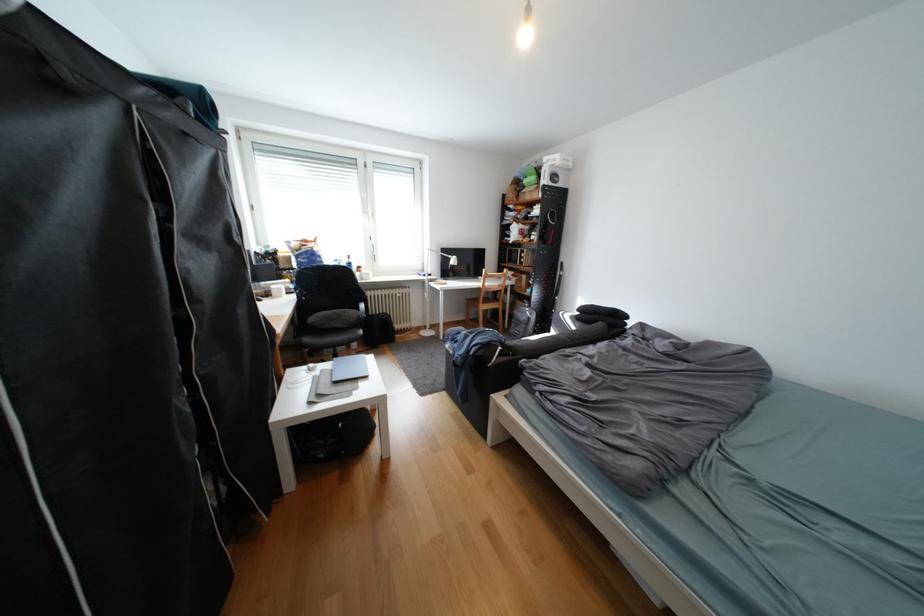
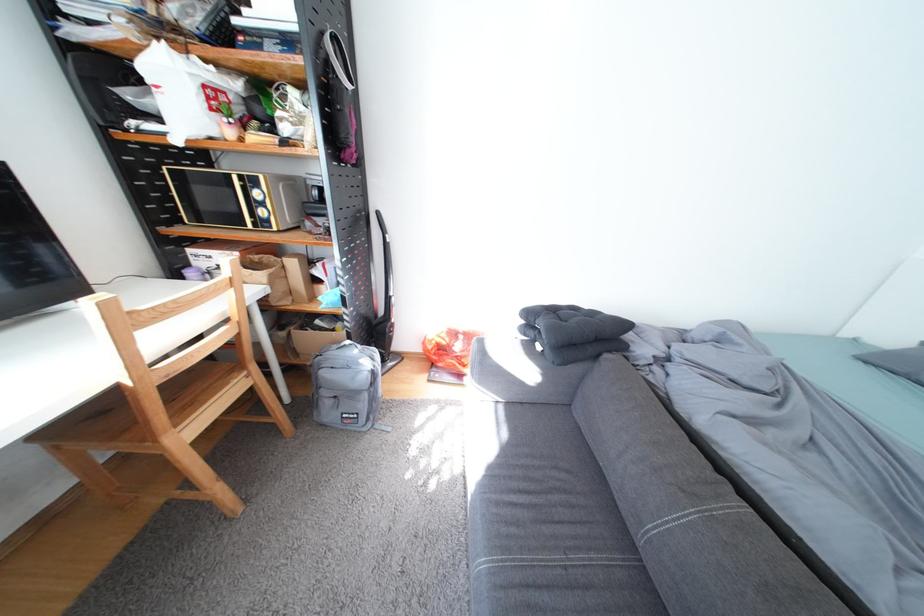
Find the pixel in the second image that matches (x=543, y=314) in the first image.

(385, 360)